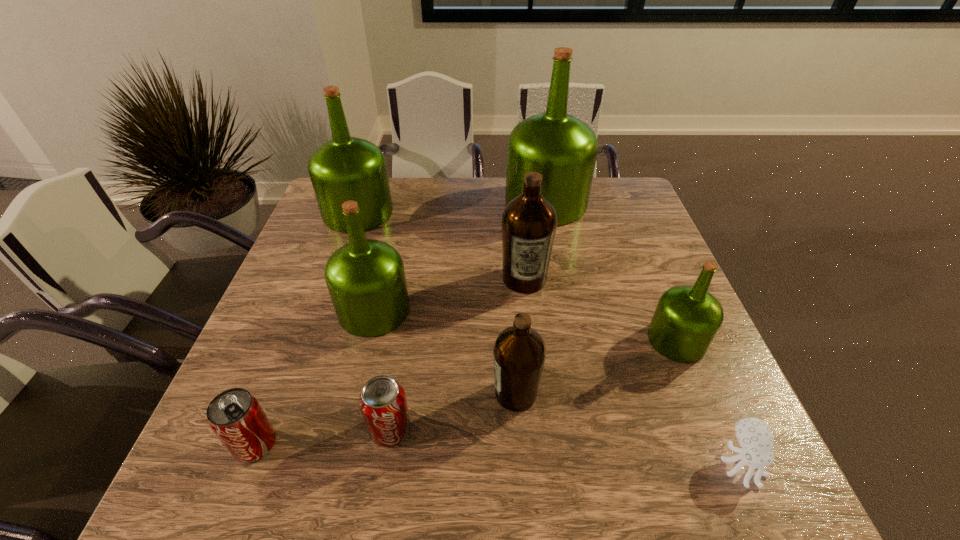
Find the location of `the left soda can`. the left soda can is located at coordinates (236, 417).

The height and width of the screenshot is (540, 960). I want to click on the right soda can, so click(382, 401).

The height and width of the screenshot is (540, 960). I want to click on the shortest object, so click(x=754, y=435).

This screenshot has height=540, width=960. I want to click on octopus, so click(x=754, y=435).

At what (x,y) coordinates should I click in order to perform the action: click on free location located 0.090m on the front of the biggest green olive oil. Please return your answer as a coordinate pair (x, y). The height and width of the screenshot is (540, 960). Looking at the image, I should click on (554, 247).

Find the location of a particular element. The width and height of the screenshot is (960, 540). vacant space located 0.260m on the right of the eighth shortest object is located at coordinates (478, 213).

Locate an element on the screen. This screenshot has height=540, width=960. blank space located 0.380m on the label of the bigger brown olive oil is located at coordinates (541, 444).

This screenshot has width=960, height=540. Find the location of `vacant space situated on the front of the third biggest green olive oil`. vacant space situated on the front of the third biggest green olive oil is located at coordinates (337, 467).

Locate an element on the screen. free point located 0.290m on the back of the smallest green olive oil is located at coordinates (636, 242).

Find the location of a particular element. The image size is (960, 540). vacant space located on the label of the nearest olive oil is located at coordinates (393, 394).